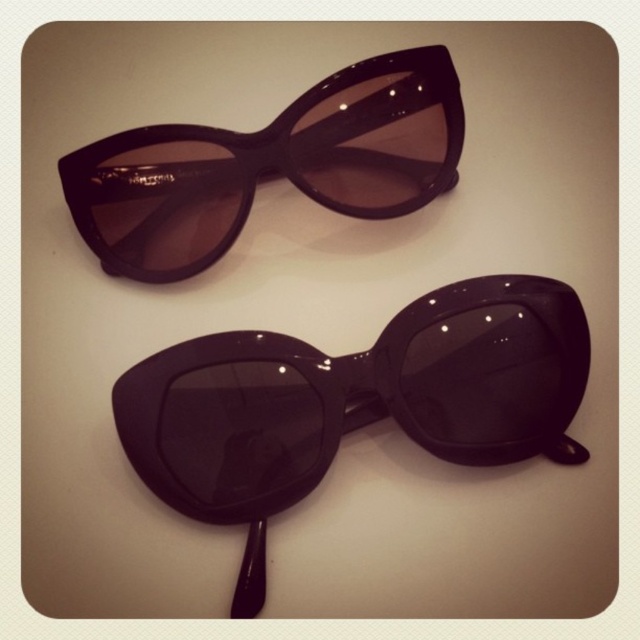
Based on the photo, does glossy black sunglasses at center appear on the left side of glossy black sunglasses at upper center?

Incorrect, glossy black sunglasses at center is not on the left side of glossy black sunglasses at upper center.

Is glossy black sunglasses at center smaller than glossy black sunglasses at upper center?

Incorrect, glossy black sunglasses at center is not smaller in size than glossy black sunglasses at upper center.

Who is more distant from viewer, (266, 385) or (99, 195)?

Positioned behind is point (266, 385).

This screenshot has height=640, width=640. What are the coordinates of `glossy black sunglasses at center` in the screenshot? It's located at (353, 403).